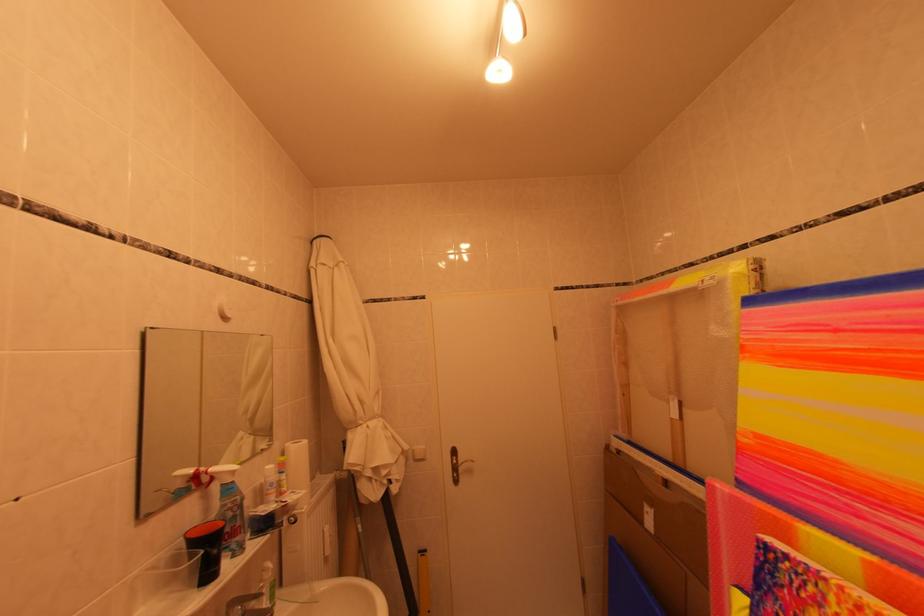
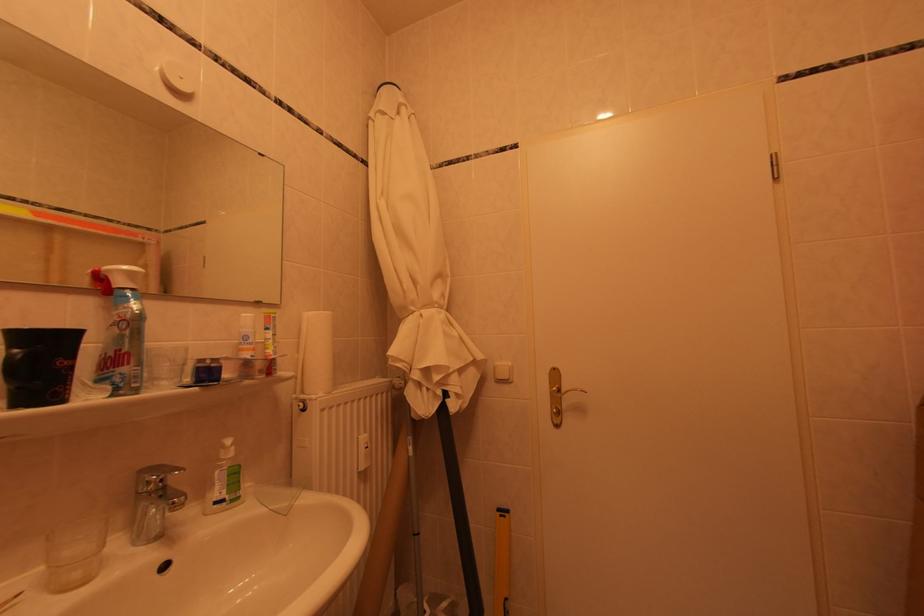
In the second image, find the point that corresponds to point 398,490 in the first image.

(456, 405)